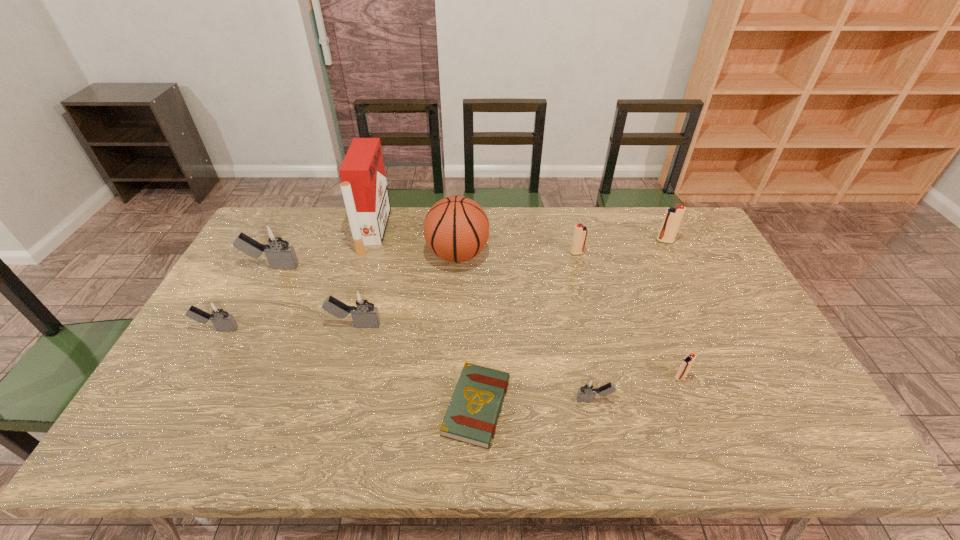
Find the location of a particular element. The image size is (960, 540). free spot between the smallest gray igniter and the rightmost igniter is located at coordinates (630, 321).

Identify the location of vacant region between the nearest red igniter and the basketball. This screenshot has height=540, width=960. (568, 316).

Identify the location of free space between the farthest igniter and the third smallest gray igniter. This screenshot has width=960, height=540. (510, 283).

Find the location of a particular element. vacant space that's between the rightmost igniter and the second gray igniter from right to left is located at coordinates (510, 283).

Identify the location of unoccupied area between the smallest gray igniter and the second smallest gray igniter. (406, 364).

Where is `vacant space that's between the second smallest gray igniter and the brown book`? The height and width of the screenshot is (540, 960). vacant space that's between the second smallest gray igniter and the brown book is located at coordinates (348, 368).

Find the location of a particular element. This screenshot has width=960, height=540. free area in between the brown book and the leftmost red igniter is located at coordinates (527, 330).

Choose which object is the sixth nearest neighbor to the third biggest gray igniter. Please provide its 2D coordinates. Your answer should be formatted as a tuple, i.e. [(x, y)], where the tuple contains the x and y coordinates of a point satisfying the conditions above.

[(588, 388)]

This screenshot has height=540, width=960. Identify the location of object that is the second closest to the basketball. (364, 312).

Identify which igniter is the nearest to the sixth igniter from left to right. Please provide its 2D coordinates. Your answer should be formatted as a tuple, i.e. [(x, y)], where the tuple contains the x and y coordinates of a point satisfying the conditions above.

[(588, 388)]